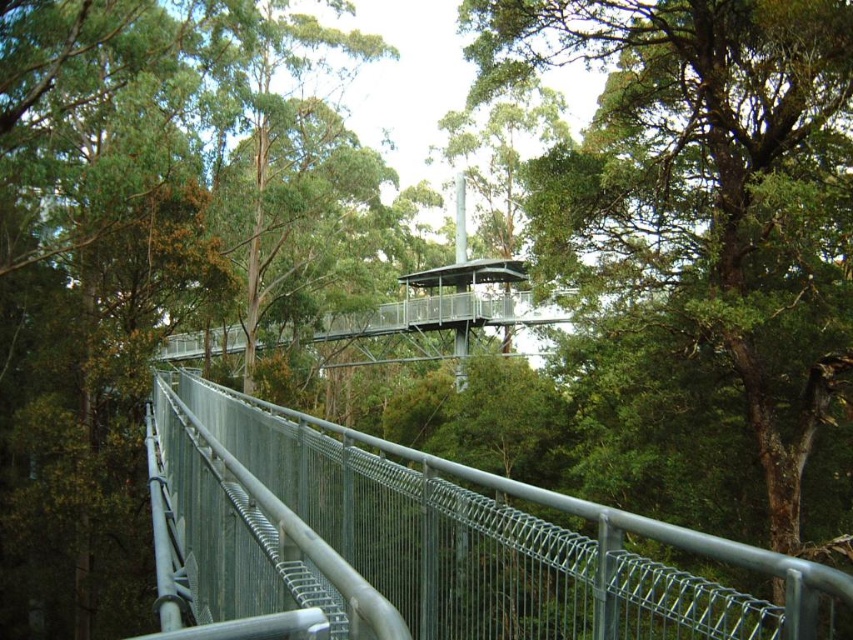
Is point (682, 36) less distant than point (212, 593)?

No, (682, 36) is behind (212, 593).

Is point (714, 257) farther from viewer compared to point (520, 538)?

Yes, it is.

Locate an element on the screen. The image size is (853, 640). green leafy tree at center is located at coordinates (704, 198).